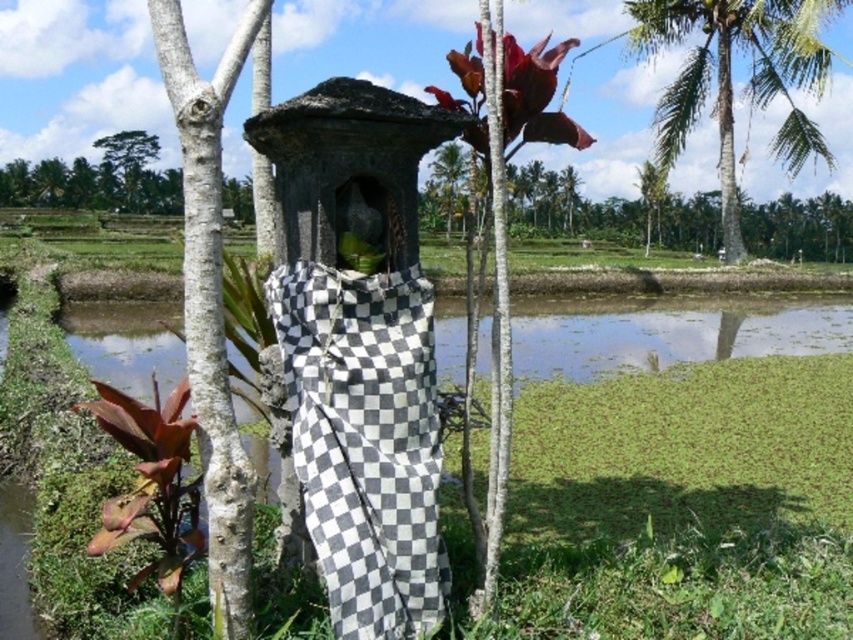
Can you confirm if black and white checkered cloth at center is positioned to the left of leathery red leaf at upper center?

Correct, you'll find black and white checkered cloth at center to the left of leathery red leaf at upper center.

Does point (297, 406) come closer to viewer compared to point (538, 120)?

That is True.

Is point (358, 611) more distant than point (486, 154)?

No, (358, 611) is in front of (486, 154).

The width and height of the screenshot is (853, 640). I want to click on black and white checkered cloth at center, so click(x=364, y=442).

In the scene shown: Is green leafy palm at upper right closer to camera compared to leathery red leaf at upper center?

No, green leafy palm at upper right is behind leathery red leaf at upper center.

What do you see at coordinates (730, 77) in the screenshot? The width and height of the screenshot is (853, 640). I see `green leafy palm at upper right` at bounding box center [730, 77].

This screenshot has width=853, height=640. In order to click on green leafy palm at upper right in this screenshot , I will do (x=730, y=77).

Can you confirm if leathery red leaf at upper center is positioned below green leafy tree at upper left?

Yes.

Between leathery red leaf at upper center and green leafy tree at upper left, which one appears on the right side from the viewer's perspective?

From the viewer's perspective, leathery red leaf at upper center appears more on the right side.

The width and height of the screenshot is (853, 640). What do you see at coordinates (535, 96) in the screenshot?
I see `leathery red leaf at upper center` at bounding box center [535, 96].

What are the coordinates of `leathery red leaf at upper center` in the screenshot? It's located at (535, 96).